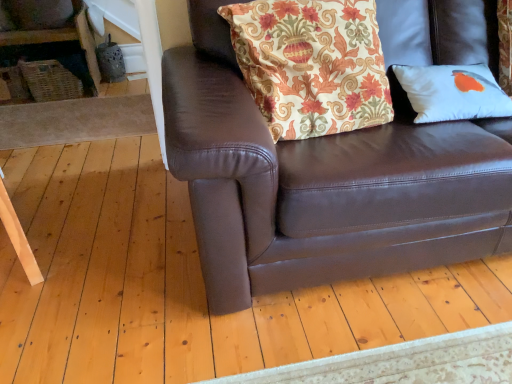
How much space does white matte pillow at upper right, which appears as the first pillow when viewed from the right, occupy vertically?

It is 17.81 centimeters.

What do you see at coordinates (322, 183) in the screenshot? This screenshot has height=384, width=512. I see `brown leather couch at center` at bounding box center [322, 183].

In order to click on matte gray vase at upper left in this screenshot , I will do `click(35, 14)`.

Locate an element on the screen. pillow located above the white matte pillow at upper right, which ranks as the second pillow in left-to-right order (from the image's perspective) is located at coordinates (311, 64).

From the picture: Is floral fabric cushion at upper center, the 2th pillow viewed from the right, positioned far away from white matte pillow at upper right, which appears as the first pillow when viewed from the right?

No, floral fabric cushion at upper center, the 2th pillow viewed from the right, is not far away from white matte pillow at upper right, which appears as the first pillow when viewed from the right.

Is white matte pillow at upper right, which ranks as the second pillow in left-to-right order, inside floral fabric cushion at upper center, the 2th pillow viewed from the right?

No.

Which of these two, floral fabric cushion at upper center, the 1th pillow positioned from the left, or white matte pillow at upper right, which ranks as the second pillow in left-to-right order, stands taller?

Standing taller between the two is floral fabric cushion at upper center, the 1th pillow positioned from the left.

Does point (39, 28) come in front of point (369, 36)?

No, it is not.

Looking at this image, is matte gray vase at upper left next to floral fabric cushion at upper center, the 2th pillow viewed from the right?

No, matte gray vase at upper left is not next to floral fabric cushion at upper center, the 2th pillow viewed from the right.

Would you say matte gray vase at upper left is outside floral fabric cushion at upper center, the 1th pillow positioned from the left?

matte gray vase at upper left is positioned outside floral fabric cushion at upper center, the 1th pillow positioned from the left.

From a real-world perspective, which is physically above, floral fabric cushion at upper center, the 1th pillow positioned from the left, or brown leather couch at center?

In real-world perspective, floral fabric cushion at upper center, the 1th pillow positioned from the left, is above.

Is the position of floral fabric cushion at upper center, the 1th pillow positioned from the left, more distant than that of brown leather couch at center?

Yes, floral fabric cushion at upper center, the 1th pillow positioned from the left, is further from the viewer.

Where is `studio couch in front of the floral fabric cushion at upper center, the 1th pillow positioned from the left`? studio couch in front of the floral fabric cushion at upper center, the 1th pillow positioned from the left is located at coordinates (322, 183).

Considering the relative sizes of floral fabric cushion at upper center, the 2th pillow viewed from the right, and brown leather couch at center in the image provided, is floral fabric cushion at upper center, the 2th pillow viewed from the right, wider than brown leather couch at center?

Incorrect, the width of floral fabric cushion at upper center, the 2th pillow viewed from the right, does not surpass that of brown leather couch at center.

Based on their sizes in the image, would you say white matte pillow at upper right, which ranks as the second pillow in left-to-right order, is bigger or smaller than brown leather couch at center?

In the image, white matte pillow at upper right, which ranks as the second pillow in left-to-right order, appears to be smaller than brown leather couch at center.

From a real-world perspective, between white matte pillow at upper right, which ranks as the second pillow in left-to-right order, and brown leather couch at center, who is vertically higher?

From a 3D spatial view, white matte pillow at upper right, which ranks as the second pillow in left-to-right order, is above.

Would you say white matte pillow at upper right, which ranks as the second pillow in left-to-right order, is outside brown leather couch at center?

No, white matte pillow at upper right, which ranks as the second pillow in left-to-right order, is not outside of brown leather couch at center.

Consider the image. What's the angular difference between white matte pillow at upper right, which appears as the first pillow when viewed from the right, and brown leather couch at center's facing directions?

1.01 degrees separate the facing orientations of white matte pillow at upper right, which appears as the first pillow when viewed from the right, and brown leather couch at center.

Is brown leather couch at center bigger than floral fabric cushion at upper center, the 2th pillow viewed from the right?

Yes, brown leather couch at center is bigger than floral fabric cushion at upper center, the 2th pillow viewed from the right.

Is brown leather couch at center facing towards floral fabric cushion at upper center, the 1th pillow positioned from the left?

Yes, brown leather couch at center is facing floral fabric cushion at upper center, the 1th pillow positioned from the left.

Is point (392, 170) farther from viewer compared to point (339, 83)?

That is False.

Considering their positions, is brown leather couch at center located in front of or behind floral fabric cushion at upper center, the 2th pillow viewed from the right?

brown leather couch at center is in front of floral fabric cushion at upper center, the 2th pillow viewed from the right.

Is matte gray vase at upper left facing away from white matte pillow at upper right, which ranks as the second pillow in left-to-right order?

No.

Is matte gray vase at upper left positioned far away from white matte pillow at upper right, which ranks as the second pillow in left-to-right order?

matte gray vase at upper left is positioned a significant distance from white matte pillow at upper right, which ranks as the second pillow in left-to-right order.

Which object is positioned more to the right, matte gray vase at upper left or white matte pillow at upper right, which appears as the first pillow when viewed from the right?

Positioned to the right is white matte pillow at upper right, which appears as the first pillow when viewed from the right.

Between point (20, 28) and point (424, 70), which one is positioned in front?

The point (424, 70) is closer.

You are a GUI agent. You are given a task and a screenshot of the screen. Output one action in this format:
    pyautogui.click(x=<x>, y=<y>)
    Task: Click on the gray on the left of white matte pillow at upper right, which appears as the first pillow when viewed from the right
    The width and height of the screenshot is (512, 384).
    Given the screenshot: What is the action you would take?
    pyautogui.click(x=35, y=14)

Is white matte pillow at upper right, which ranks as the second pillow in left-to-right order, beside matte gray vase at upper left?

There is a gap between white matte pillow at upper right, which ranks as the second pillow in left-to-right order, and matte gray vase at upper left.

Can you tell me how much white matte pillow at upper right, which appears as the first pillow when viewed from the right, and matte gray vase at upper left differ in facing direction?

They differ by 2.84 degrees in their facing directions.

Is white matte pillow at upper right, which appears as the first pillow when viewed from the right, facing towards matte gray vase at upper left?

No, white matte pillow at upper right, which appears as the first pillow when viewed from the right, is not aimed at matte gray vase at upper left.

The height and width of the screenshot is (384, 512). I want to click on pillow in front of the white matte pillow at upper right, which appears as the first pillow when viewed from the right, so click(x=311, y=64).

At what (x,y) coordinates should I click in order to perform the action: click on the 1st pillow counting from the right side of the matte gray vase at upper left. Please return your answer as a coordinate pair (x, y). Looking at the image, I should click on (311, 64).

Consider the image. Which object lies further to the anchor point brown leather couch at center, matte gray vase at upper left or floral fabric cushion at upper center, the 1th pillow positioned from the left?

matte gray vase at upper left is further to brown leather couch at center.

Looking at the image, which one is located further to matte gray vase at upper left, white matte pillow at upper right, which appears as the first pillow when viewed from the right, or floral fabric cushion at upper center, the 2th pillow viewed from the right?

Based on the image, white matte pillow at upper right, which appears as the first pillow when viewed from the right, appears to be further to matte gray vase at upper left.

Which object lies further to the anchor point brown leather couch at center, floral fabric cushion at upper center, the 2th pillow viewed from the right, or white matte pillow at upper right, which ranks as the second pillow in left-to-right order?

The object further to brown leather couch at center is white matte pillow at upper right, which ranks as the second pillow in left-to-right order.

From the image, which object appears to be nearer to matte gray vase at upper left, brown leather couch at center or white matte pillow at upper right, which ranks as the second pillow in left-to-right order?

Based on the image, brown leather couch at center appears to be nearer to matte gray vase at upper left.

Considering their positions, is brown leather couch at center positioned closer to white matte pillow at upper right, which appears as the first pillow when viewed from the right, than floral fabric cushion at upper center, the 1th pillow positioned from the left?

The object closer to white matte pillow at upper right, which appears as the first pillow when viewed from the right, is floral fabric cushion at upper center, the 1th pillow positioned from the left.

From the image, which object appears to be farther from white matte pillow at upper right, which ranks as the second pillow in left-to-right order, matte gray vase at upper left or brown leather couch at center?

The object further to white matte pillow at upper right, which ranks as the second pillow in left-to-right order, is matte gray vase at upper left.

Based on their spatial positions, is brown leather couch at center or matte gray vase at upper left further from white matte pillow at upper right, which ranks as the second pillow in left-to-right order?

matte gray vase at upper left is positioned further to the anchor white matte pillow at upper right, which ranks as the second pillow in left-to-right order.

Considering their positions, is floral fabric cushion at upper center, the 2th pillow viewed from the right, positioned closer to brown leather couch at center than matte gray vase at upper left?

The object closer to brown leather couch at center is floral fabric cushion at upper center, the 2th pillow viewed from the right.

Find the location of a particular element. This screenshot has width=512, height=384. pillow positioned between brown leather couch at center and white matte pillow at upper right, which ranks as the second pillow in left-to-right order, from near to far is located at coordinates (311, 64).

Locate an element on the screen. This screenshot has width=512, height=384. studio couch between matte gray vase at upper left and white matte pillow at upper right, which appears as the first pillow when viewed from the right, from left to right is located at coordinates (322, 183).

The width and height of the screenshot is (512, 384). Find the location of `pillow between matte gray vase at upper left and white matte pillow at upper right, which ranks as the second pillow in left-to-right order, from left to right`. pillow between matte gray vase at upper left and white matte pillow at upper right, which ranks as the second pillow in left-to-right order, from left to right is located at coordinates (311, 64).